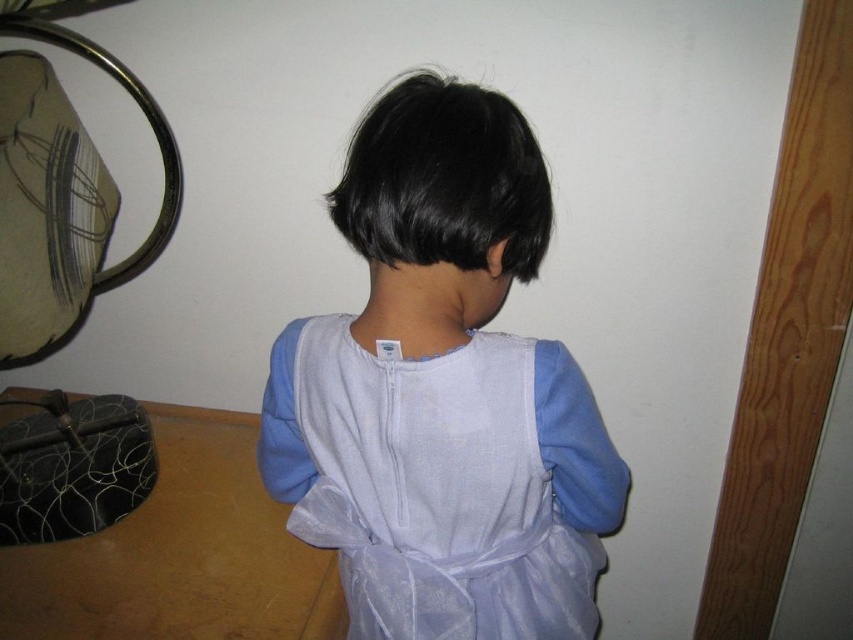
Question: Which object appears closest to the camera in this image?

Choices:
 (A) black silky hair at center
 (B) light blue sheer fabric apron at back
 (C) light blue fabric dress at center

Answer: (A)

Question: Is light blue sheer fabric apron at back further to camera compared to black silky hair at center?

Choices:
 (A) no
 (B) yes

Answer: (B)

Question: Does light blue fabric dress at center appear on the left side of black silky hair at center?

Choices:
 (A) yes
 (B) no

Answer: (A)

Question: Among these objects, which one is farthest from the camera?

Choices:
 (A) light blue sheer fabric apron at back
 (B) light blue fabric dress at center
 (C) black silky hair at center

Answer: (A)

Question: Is light blue sheer fabric apron at back smaller than black silky hair at center?

Choices:
 (A) no
 (B) yes

Answer: (A)

Question: Among these objects, which one is nearest to the camera?

Choices:
 (A) light blue fabric dress at center
 (B) light blue sheer fabric apron at back
 (C) black silky hair at center

Answer: (C)